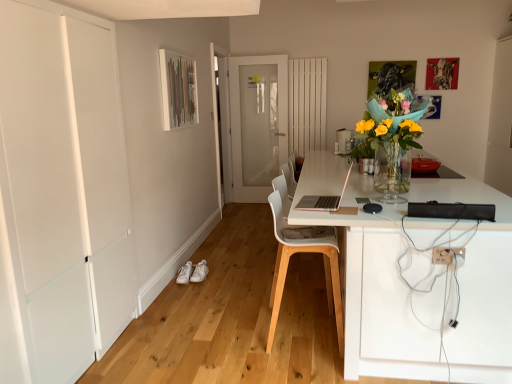
This screenshot has width=512, height=384. Describe the element at coordinates (257, 123) in the screenshot. I see `white frosted glass door at center, positioned as the 1th door in right-to-left order` at that location.

The image size is (512, 384). Find the location of `white plastic chair at center`. white plastic chair at center is located at coordinates (287, 269).

What do you see at coordinates (287, 269) in the screenshot? I see `white plastic chair at center` at bounding box center [287, 269].

What do you see at coordinates (199, 272) in the screenshot? I see `white leather shoe at lower center, placed as the 1th shoe when sorted from right to left` at bounding box center [199, 272].

Describe the element at coordinates (323, 199) in the screenshot. The image size is (512, 384). I see `pink matte laptop at center` at that location.

This screenshot has width=512, height=384. Identify the location of white frosted glass door at center, the 2th door viewed from the front. (257, 123).

From the image's perspective, is white matte door at left, the 2th door when ordered from back to front, above or below white leather shoe at lower left, which is counted as the first shoe, starting from the left?

white matte door at left, the 2th door when ordered from back to front, is situated higher than white leather shoe at lower left, which is counted as the first shoe, starting from the left, in the image.

Which of these two, white matte door at left, which ranks as the first door in front-to-back order, or white leather shoe at lower left, which is counted as the first shoe, starting from the left, is bigger?

Bigger between the two is white matte door at left, which ranks as the first door in front-to-back order.

Relative to white leather shoe at lower left, which is counted as the first shoe, starting from the left, is white matte door at left, the 2th door when ordered from back to front, in front or behind?

Visually, white matte door at left, the 2th door when ordered from back to front, is located in front of white leather shoe at lower left, which is counted as the first shoe, starting from the left.

Is white matte door at left, the first door viewed from the left, turned away from white leather shoe at lower left, which is counted as the first shoe, starting from the left?

No, white matte door at left, the first door viewed from the left,'s orientation is not away from white leather shoe at lower left, which is counted as the first shoe, starting from the left.

Is point (406, 174) closer or farther from the camera than point (199, 278)?

Point (406, 174) is closer to the camera than point (199, 278).

Is translucent glass vase at center positioned behind white leather shoe at lower center, the 2th shoe from the left?

No, translucent glass vase at center is closer to the viewer.

Considering the relative positions of translucent glass vase at center and white leather shoe at lower center, the 2th shoe from the left, in the image provided, is translucent glass vase at center to the left of white leather shoe at lower center, the 2th shoe from the left, from the viewer's perspective?

Incorrect, translucent glass vase at center is not on the left side of white leather shoe at lower center, the 2th shoe from the left.

Looking at this image, is translucent glass vase at center wider or thinner than white leather shoe at lower center, the 2th shoe from the left?

Considering their sizes, translucent glass vase at center looks broader than white leather shoe at lower center, the 2th shoe from the left.

Identify the location of door that is the 2nd object located above the white plastic electric outlet at lower right (from the image's perspective). (257, 123).

Are white frosted glass door at center, the 2th door viewed from the front, and white plastic electric outlet at lower right making contact?

No, white frosted glass door at center, the 2th door viewed from the front, is not with white plastic electric outlet at lower right.

In the scene shown: Between white frosted glass door at center, the 2th door viewed from the front, and white plastic electric outlet at lower right, which one has less height?

white plastic electric outlet at lower right.

Does white frosted glass door at center, the 2th door viewed from the front, have a smaller size compared to white plastic electric outlet at lower right?

No, white frosted glass door at center, the 2th door viewed from the front, is not smaller than white plastic electric outlet at lower right.

From a real-world perspective, which is physically below, white frosted glass door at center, arranged as the first door when viewed from the back, or white plastic chair at center?

From a 3D spatial view, white plastic chair at center is below.

Which of these two, white frosted glass door at center, positioned as the 1th door in right-to-left order, or white plastic chair at center, stands taller?

white frosted glass door at center, positioned as the 1th door in right-to-left order.

What's the angular difference between white frosted glass door at center, which is counted as the second door, starting from the left, and white plastic chair at center's facing directions?

90.8 degrees.

Is white frosted glass door at center, the 2th door viewed from the front, with white plastic chair at center?

No, white frosted glass door at center, the 2th door viewed from the front, is not touching white plastic chair at center.

Is the surface of white matte door at left, the 2th door when ordered from back to front, in direct contact with translucent glass vase at center?

They are not placed beside each other.

Is white matte door at left, which ranks as the second door in right-to-left order, aimed at translucent glass vase at center?

Yes, white matte door at left, which ranks as the second door in right-to-left order, faces towards translucent glass vase at center.

Between white matte door at left, which ranks as the second door in right-to-left order, and translucent glass vase at center, which one appears on the left side from the viewer's perspective?

From the viewer's perspective, white matte door at left, which ranks as the second door in right-to-left order, appears more on the left side.

Considering the sizes of objects white plastic chair at center and white leather shoe at lower left, which is counted as the second shoe, starting from the right, in the image provided, who is smaller, white plastic chair at center or white leather shoe at lower left, which is counted as the second shoe, starting from the right,?

Smaller between the two is white leather shoe at lower left, which is counted as the second shoe, starting from the right.

From the image's perspective, count 2nd shoes downward from the white plastic chair at center and point to it. Please provide its 2D coordinates.

[(184, 273)]

How different are the orientations of white plastic chair at center and white leather shoe at lower left, which is counted as the second shoe, starting from the right, in degrees?

The facing directions of white plastic chair at center and white leather shoe at lower left, which is counted as the second shoe, starting from the right, are 90.6 degrees apart.

Could you tell me if white plastic chair at center is facing white leather shoe at lower left, which is counted as the second shoe, starting from the right?

No, white plastic chair at center is not oriented towards white leather shoe at lower left, which is counted as the second shoe, starting from the right.

Could you tell me if white plastic electric outlet at lower right is facing white plastic chair at center?

No, white plastic electric outlet at lower right is not facing towards white plastic chair at center.

In the scene shown: In the image, is white plastic electric outlet at lower right positioned in front of or behind white plastic chair at center?

white plastic electric outlet at lower right is positioned closer to the viewer than white plastic chair at center.

Between white plastic electric outlet at lower right and white plastic chair at center, which one has larger width?

white plastic chair at center.

How many degrees apart are the facing directions of white plastic electric outlet at lower right and white plastic chair at center?

90 degrees.

At what (x,y) coordinates should I click in order to perform the action: click on door lying on the left of white leather shoe at lower left, which is counted as the second shoe, starting from the right. Please return your answer as a coordinate pair (x, y). Image resolution: width=512 pixels, height=384 pixels. Looking at the image, I should click on (42, 194).

This screenshot has width=512, height=384. In order to click on shoe that is the 1st one when counting downward from the translucent glass vase at center (from the image's perspective) in this screenshot , I will do `click(199, 272)`.

Which object lies further to the anchor point white matte door at left, which ranks as the first door in front-to-back order, white leather shoe at lower center, the 2th shoe from the left, or pink matte laptop at center?

The object further to white matte door at left, which ranks as the first door in front-to-back order, is white leather shoe at lower center, the 2th shoe from the left.

Based on their spatial positions, is white frosted glass door at center, arranged as the first door when viewed from the back, or white leather shoe at lower left, which is counted as the first shoe, starting from the left, closer to white leather shoe at lower center, placed as the 1th shoe when sorted from right to left?

The object closer to white leather shoe at lower center, placed as the 1th shoe when sorted from right to left, is white leather shoe at lower left, which is counted as the first shoe, starting from the left.

Estimate the real-world distances between objects in this image. Which object is closer to white frosted glass door at center, which is counted as the second door, starting from the left, pink matte laptop at center or white leather shoe at lower center, placed as the 1th shoe when sorted from right to left?

white leather shoe at lower center, placed as the 1th shoe when sorted from right to left, lies closer to white frosted glass door at center, which is counted as the second door, starting from the left, than the other object.

Based on their spatial positions, is white leather shoe at lower left, which is counted as the second shoe, starting from the right, or white matte door at left, which ranks as the first door in front-to-back order, further from white leather shoe at lower center, the 2th shoe from the left?

The object further to white leather shoe at lower center, the 2th shoe from the left, is white matte door at left, which ranks as the first door in front-to-back order.

Based on their spatial positions, is white leather shoe at lower center, the 2th shoe from the left, or white frosted glass door at center, which is counted as the second door, starting from the left, closer to white plastic chair at center?

white leather shoe at lower center, the 2th shoe from the left, lies closer to white plastic chair at center than the other object.

From the image, which object appears to be nearer to white plastic chair at center, white leather shoe at lower center, the 2th shoe from the left, or translucent glass vase at center?

Based on the image, translucent glass vase at center appears to be nearer to white plastic chair at center.

In the scene shown: Which object lies further to the anchor point pink matte laptop at center, white frosted glass door at center, arranged as the first door when viewed from the back, or white leather shoe at lower center, the 2th shoe from the left?

The object further to pink matte laptop at center is white frosted glass door at center, arranged as the first door when viewed from the back.

In the scene shown: Estimate the real-world distances between objects in this image. Which object is further from white plastic electric outlet at lower right, white frosted glass door at center, which is counted as the second door, starting from the left, or translucent glass vase at center?

white frosted glass door at center, which is counted as the second door, starting from the left, lies further to white plastic electric outlet at lower right than the other object.

You are a GUI agent. You are given a task and a screenshot of the screen. Output one action in this format:
    pyautogui.click(x=<x>, y=<y>)
    Task: Click on the floral arrangement located between white plastic electric outlet at lower right and white frosted glass door at center, positioned as the 1th door in right-to-left order, in the depth direction
    This screenshot has height=384, width=512.
    Given the screenshot: What is the action you would take?
    pyautogui.click(x=392, y=140)

Where is `computer between white matte door at left, which ranks as the second door in right-to-left order, and white leather shoe at lower left, which is counted as the second shoe, starting from the right, along the z-axis`? This screenshot has width=512, height=384. computer between white matte door at left, which ranks as the second door in right-to-left order, and white leather shoe at lower left, which is counted as the second shoe, starting from the right, along the z-axis is located at coordinates (323, 199).

The image size is (512, 384). What are the coordinates of `shoe between white plastic chair at center and white leather shoe at lower center, the 2th shoe from the left, in the front-back direction` in the screenshot? It's located at (184, 273).

Locate an element on the screen. electric outlet between white matte door at left, which ranks as the second door in right-to-left order, and white frosted glass door at center, arranged as the first door when viewed from the back, from front to back is located at coordinates (446, 254).